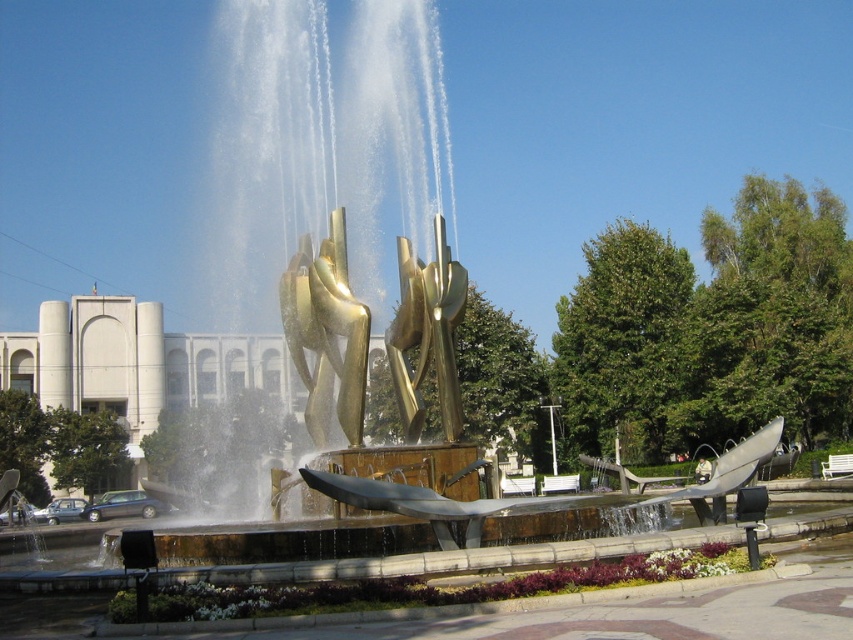
Consider the image. You are standing at the entrance of the urban area and want to locate the gold metallic water at center. According to the coordinates provided, in which direction should you walk to reach it?

The gold metallic water at center is located at coordinates point (366, 227). Since you are at the entrance, you should walk towards the center of the area to reach it.

You are standing in the urban area and want to take a photo of the gold polished sculpture at center without the gold metallic water at center appearing in the foreground. Is this possible given their positions?

The gold metallic water at center is closer to the viewer than the gold polished sculpture at center. To avoid the water in the foreground, you would need to adjust your angle or position so that the sculpture is framed without the water obstructing it. However, since the water is closer, it may still appear in front unless you move to a position where the sculpture is fully behind the water, which might not be feasible. Alternatively, using a longer focal length to compress the perspective could help focus